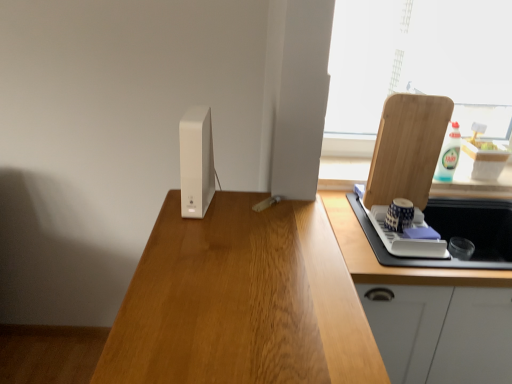
Image resolution: width=512 pixels, height=384 pixels. In order to click on vacant space to the left of blue and white ceramic cup at right, the 1th appliance from the bottom in this screenshot , I will do `click(356, 225)`.